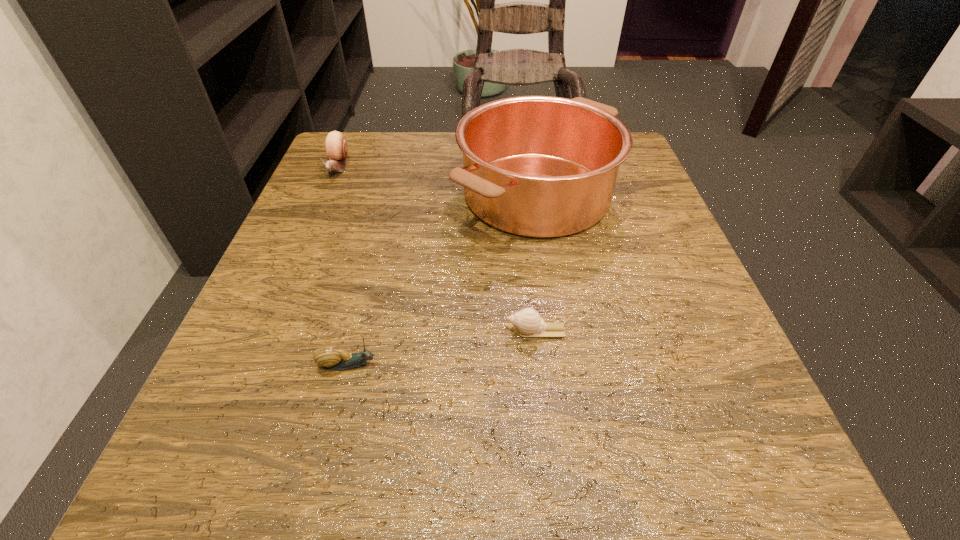
I want to click on free space located 0.110m on the shell of the second nearest escargot, so click(x=430, y=331).

The image size is (960, 540). I want to click on vacant space located on the shell of the second nearest escargot, so click(368, 331).

The height and width of the screenshot is (540, 960). Identify the location of free space located on the shell of the second nearest escargot. (375, 331).

The width and height of the screenshot is (960, 540). I want to click on saucepan that is positioned at the far edge, so click(x=537, y=166).

Where is `escargot that is positioned at the far edge`? escargot that is positioned at the far edge is located at coordinates (336, 148).

Locate an element on the screen. This screenshot has height=540, width=960. object that is positioned at the right edge is located at coordinates (537, 166).

This screenshot has width=960, height=540. Find the location of `object present at the far left corner`. object present at the far left corner is located at coordinates (336, 148).

Locate an element on the screen. object that is at the far right corner is located at coordinates pyautogui.click(x=537, y=166).

In order to click on vacant space at the near edge of the desktop in this screenshot , I will do `click(411, 455)`.

Where is `free space at the left edge of the desktop`? free space at the left edge of the desktop is located at coordinates (305, 260).